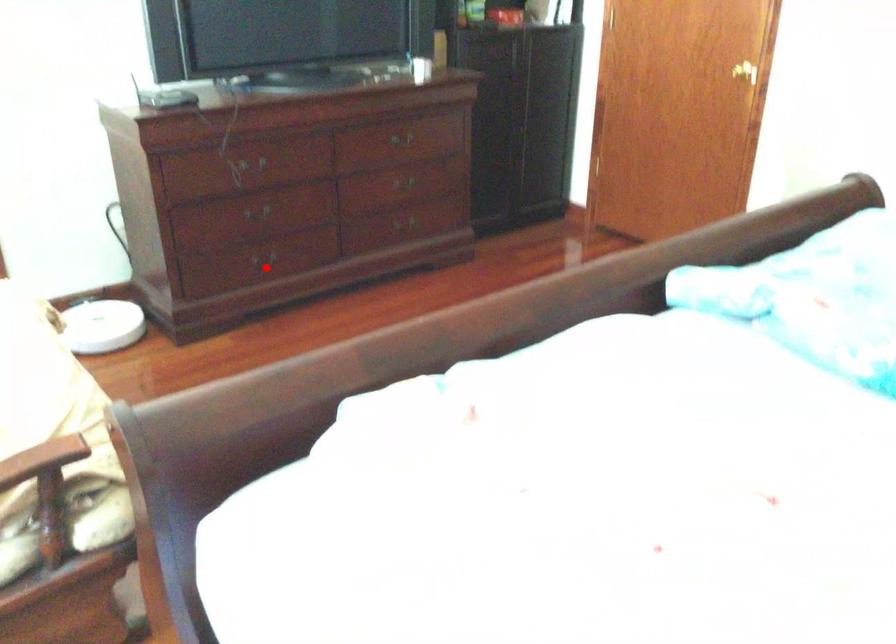
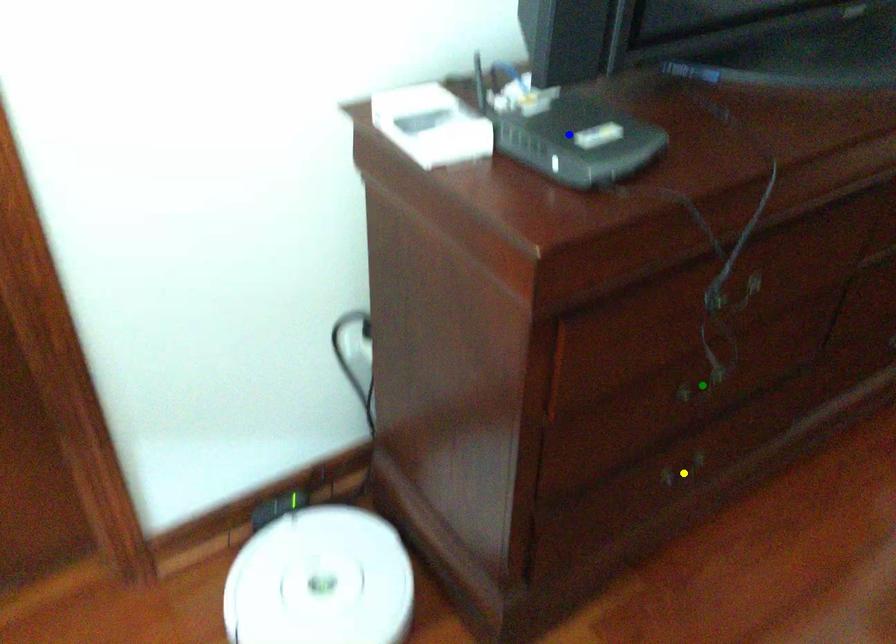
Question: I am providing you with two images of the same scene from different viewpoints. A red point is marked on the first image. You are given multiple points on the second image. In image 2, which mark is for the same physical point as the one in image 1?

Choices:
 (A) blue point
 (B) green point
 (C) yellow point

Answer: (C)